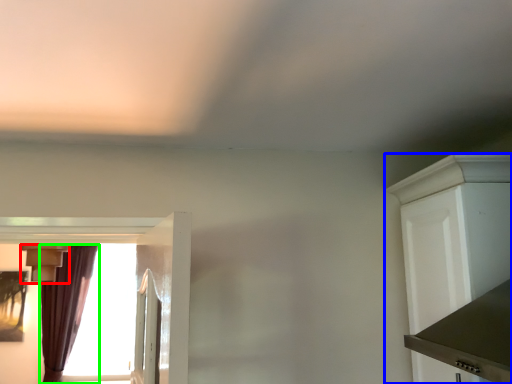
Question: Considering the real-world distances, which object is closest to light fixture (highlighted by a red box)? cabinetry (highlighted by a blue box) or curtain (highlighted by a green box).

Choices:
 (A) cabinetry
 (B) curtain

Answer: (B)